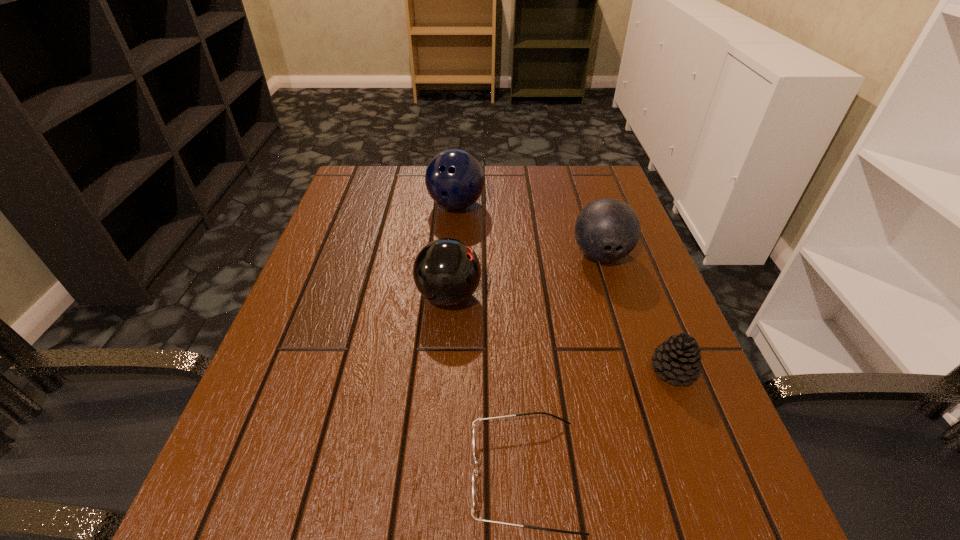
The width and height of the screenshot is (960, 540). I want to click on vacant space located at the narrow end of the pinecone, so click(497, 370).

The height and width of the screenshot is (540, 960). Identify the location of vacant space located 0.320m through the lenses of the nearest object. (251, 475).

The width and height of the screenshot is (960, 540). I want to click on blank area located 0.320m through the lenses of the nearest object, so coord(251,475).

Find the location of a particular element. vacant space located through the lenses of the nearest object is located at coordinates (292, 475).

This screenshot has width=960, height=540. I want to click on object that is at the far edge, so click(455, 179).

Find the location of a particular element. object that is at the near edge is located at coordinates (475, 471).

Locate an element on the screen. This screenshot has height=540, width=960. bowling ball that is at the right edge is located at coordinates (607, 229).

You are a GUI agent. You are given a task and a screenshot of the screen. Output one action in this format:
    pyautogui.click(x=<x>, y=<y>)
    Task: Click on the pinecone located at the right edge
    Image resolution: width=960 pixels, height=540 pixels.
    Given the screenshot: What is the action you would take?
    pyautogui.click(x=678, y=358)

Identify the location of free space at the far edge of the desktop. This screenshot has height=540, width=960. (491, 194).

The width and height of the screenshot is (960, 540). In order to click on vacant space at the near edge of the desktop in this screenshot , I will do `click(389, 521)`.